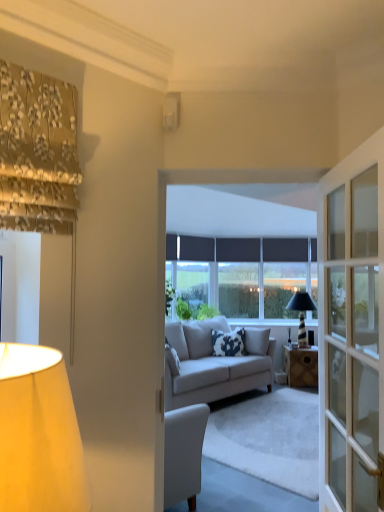
The width and height of the screenshot is (384, 512). Identify the location of white glossy switch at upper center, which is counted as the 3th lamp, starting from the bottom. (171, 111).

What is the approximate height of white cotton pillow at center?

white cotton pillow at center is 52.50 centimeters in height.

What is the approximate width of white fabric lampshade at left, the second lamp positioned from the top?

white fabric lampshade at left, the second lamp positioned from the top, is 19.73 inches in width.

The height and width of the screenshot is (512, 384). Find the location of `wooden desk at center`. wooden desk at center is located at coordinates (300, 365).

From their relative heights in the image, would you say white fabric lampshade at left, which appears as the first lamp when viewed from the front, is taller or shorter than light gray fabric couch at center?

In the image, white fabric lampshade at left, which appears as the first lamp when viewed from the front, appears to be shorter than light gray fabric couch at center.

Is light gray fabric couch at center completely or partially inside white fabric lampshade at left, placed as the third lamp when sorted from right to left?

No, light gray fabric couch at center is not inside white fabric lampshade at left, placed as the third lamp when sorted from right to left.

Which point is more forward, (85, 479) or (203, 329)?

The point (85, 479) is closer to the camera.

From the picture: Is white glossy switch at upper center, which is counted as the 3th lamp, starting from the bottom, in front of matte black window at center?

Yes.

Can you tell me how much white glossy switch at upper center, the second lamp from the back, and matte black window at center differ in facing direction?

The facing directions of white glossy switch at upper center, the second lamp from the back, and matte black window at center are 2.5 degrees apart.

Which is in front, point (163, 102) or point (243, 253)?

The point (163, 102) is more forward.

Can you confirm if white glossy switch at upper center, the second lamp viewed from the right, is wider than matte black window at center?

Incorrect, the width of white glossy switch at upper center, the second lamp viewed from the right, does not surpass that of matte black window at center.

Between black glass lamp at center, the first lamp ordered from the bottom, and white glossy switch at upper center, which is the 2th lamp from front to back, which one has larger width?

Wider between the two is black glass lamp at center, the first lamp ordered from the bottom.

From their relative heights in the image, would you say black glass lamp at center, the first lamp ordered from the bottom, is taller or shorter than white glossy switch at upper center, which is the first lamp in top-to-bottom order?

black glass lamp at center, the first lamp ordered from the bottom, is taller than white glossy switch at upper center, which is the first lamp in top-to-bottom order.

Is black glass lamp at center, the first lamp ordered from the bottom, turned away from white glossy switch at upper center, which is the 2th lamp from front to back?

No, black glass lamp at center, the first lamp ordered from the bottom, is not facing away from white glossy switch at upper center, which is the 2th lamp from front to back.

Does black glass lamp at center, the first lamp ordered from the bottom, have a smaller size compared to white glossy switch at upper center, which is the 2th lamp from front to back?

No.

Is wooden desk at center facing away from black glass lamp at center, the 3th lamp from the top?

No, wooden desk at center's orientation is not away from black glass lamp at center, the 3th lamp from the top.

From a real-world perspective, who is located higher, wooden desk at center or black glass lamp at center, the first lamp ordered from the bottom?

black glass lamp at center, the first lamp ordered from the bottom.

Is point (289, 384) more distant than point (294, 295)?

No, it is not.

Identify the location of desk located on the left of black glass lamp at center, the first lamp ordered from the bottom. The image size is (384, 512). (300, 365).

What's the angular difference between white glossy switch at upper center, the second lamp viewed from the right, and white cotton pillow at center's facing directions?

white glossy switch at upper center, the second lamp viewed from the right, and white cotton pillow at center are facing 2.7 degrees away from each other.

Does white glossy switch at upper center, which is the 2th lamp from front to back, appear on the left side of white cotton pillow at center?

Yes.

Who is more distant, white glossy switch at upper center, which is the first lamp in top-to-bottom order, or white cotton pillow at center?

white cotton pillow at center is more distant.

Which of these two, matte black window at center or wooden desk at center, stands taller?

matte black window at center is taller.

Is matte black window at center oriented towards wooden desk at center?

No, matte black window at center is not turned towards wooden desk at center.

Who is smaller, matte black window at center or wooden desk at center?

wooden desk at center.

Considering the points (252, 310) and (303, 362), which point is behind, point (252, 310) or point (303, 362)?

The point (252, 310) is farther.

Is wooden desk at center inside white glossy switch at upper center, the second lamp from the back?

That's incorrect, wooden desk at center is not inside white glossy switch at upper center, the second lamp from the back.

Which is in front, point (177, 106) or point (295, 376)?

The point (177, 106) is closer.

Is white glossy switch at upper center, which is the first lamp in top-to-bottom order, placed right next to wooden desk at center?

No, white glossy switch at upper center, which is the first lamp in top-to-bottom order, is not beside wooden desk at center.

Locate an element on the screen. Image resolution: width=384 pixels, height=512 pixels. lamp that is the 2nd one when counting forward from the light gray fabric couch at center is located at coordinates (39, 433).

Identify the location of window that appears behind the white glossy switch at upper center, the second lamp viewed from the right. click(239, 275).

From the image, which object appears to be nearer to white glossy switch at upper center, arranged as the 2th lamp when viewed from the left, black glass lamp at center, the 1th lamp viewed from the back, or white fabric lampshade at left, the 1th lamp positioned from the left?

The object closer to white glossy switch at upper center, arranged as the 2th lamp when viewed from the left, is white fabric lampshade at left, the 1th lamp positioned from the left.

Looking at the image, which one is located closer to matte black window at center, light gray fabric couch at center or black glass lamp at center, the 1th lamp in the right-to-left sequence?

black glass lamp at center, the 1th lamp in the right-to-left sequence.

Consider the image. Estimate the real-world distances between objects in this image. Which object is closer to matte black window at center, white glossy switch at upper center, arranged as the 2th lamp when viewed from the left, or white cotton pillow at center?

white cotton pillow at center is closer to matte black window at center.

Considering their positions, is white cotton pillow at center positioned further to wooden desk at center than matte black window at center?

Among the two, matte black window at center is located further to wooden desk at center.

Looking at this image, based on their spatial positions, is white glossy switch at upper center, arranged as the 2th lamp when viewed from the left, or black glass lamp at center, the 3th lamp from the top, closer to light gray fabric couch at center?

Based on the image, black glass lamp at center, the 3th lamp from the top, appears to be nearer to light gray fabric couch at center.

Which object lies further to the anchor point white fabric lampshade at left, marked as the second lamp in a bottom-to-top arrangement, white glossy switch at upper center, the second lamp from the back, or light gray fabric couch at center?

light gray fabric couch at center lies further to white fabric lampshade at left, marked as the second lamp in a bottom-to-top arrangement, than the other object.

Looking at the image, which one is located further to matte black window at center, black glass lamp at center, which is the third lamp in left-to-right order, or white fabric lampshade at left, arranged as the 3th lamp when viewed from the back?

white fabric lampshade at left, arranged as the 3th lamp when viewed from the back.

Looking at the image, which one is located further to matte black window at center, white fabric lampshade at left, arranged as the 3th lamp when viewed from the back, or white glossy switch at upper center, arranged as the 2th lamp when viewed from the left?

The object further to matte black window at center is white fabric lampshade at left, arranged as the 3th lamp when viewed from the back.

You are a GUI agent. You are given a task and a screenshot of the screen. Output one action in this format:
    pyautogui.click(x=<x>, y=<y>)
    Task: Click on the studio couch located between white glossy switch at upper center, arranged as the 2th lamp when viewed from the left, and wooden desk at center in the depth direction
    
    Given the screenshot: What is the action you would take?
    pyautogui.click(x=215, y=364)

The image size is (384, 512). Find the location of `window between white cotton pillow at center and wooden desk at center from left to right`. window between white cotton pillow at center and wooden desk at center from left to right is located at coordinates (239, 275).

This screenshot has width=384, height=512. Find the location of `studio couch between white glossy switch at upper center, which is the first lamp in top-to-bottom order, and black glass lamp at center, the 3th lamp from the top, in the front-back direction`. studio couch between white glossy switch at upper center, which is the first lamp in top-to-bottom order, and black glass lamp at center, the 3th lamp from the top, in the front-back direction is located at coordinates (215, 364).

Find the location of a particular element. This screenshot has height=512, width=384. studio couch positioned between white fabric lampshade at left, arranged as the 3th lamp when viewed from the back, and black glass lamp at center, the third lamp viewed from the front, from near to far is located at coordinates (215, 364).